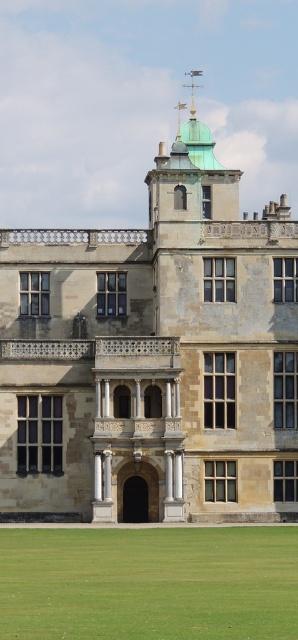
Is point (0, 433) positioned behind point (95, 540)?

Yes, point (0, 433) is behind point (95, 540).

Locate an element on the screen. The image size is (298, 640). stone textured palace at center is located at coordinates (154, 355).